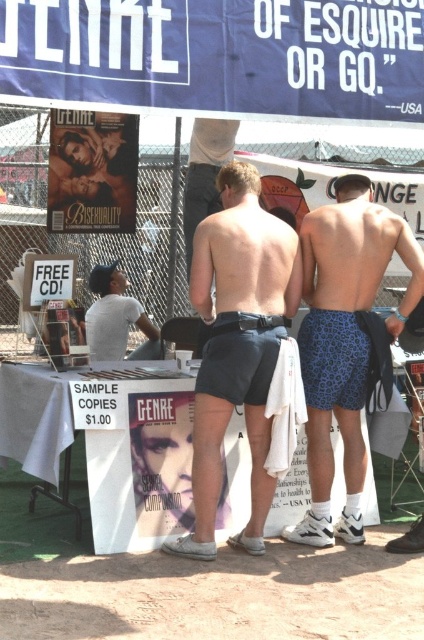
Question: Is blue leopard print shorts at center below white fabric shorts at center?

Choices:
 (A) yes
 (B) no

Answer: (B)

Question: Which of the following is the farthest from the observer?

Choices:
 (A) (359, 262)
 (B) (242, 52)

Answer: (A)

Question: Among these points, which one is nearest to the camera?

Choices:
 (A) (284, 396)
 (B) (211, 179)
 (C) (231, 225)

Answer: (A)

Question: Observing the image, what is the correct spatial positioning of blue leopard print shorts at center in reference to matte black shorts at center?

Choices:
 (A) below
 (B) above

Answer: (A)

Question: Which is farther from the blue leopard print shorts at center?

Choices:
 (A) dark blue shorts at center
 (B) matte black shorts at center
 (C) blue fabric canopy at upper center
 (D) white t-shirt at center

Answer: (D)

Question: Is white t-shirt at center wider than white fabric shorts at center?

Choices:
 (A) no
 (B) yes

Answer: (B)